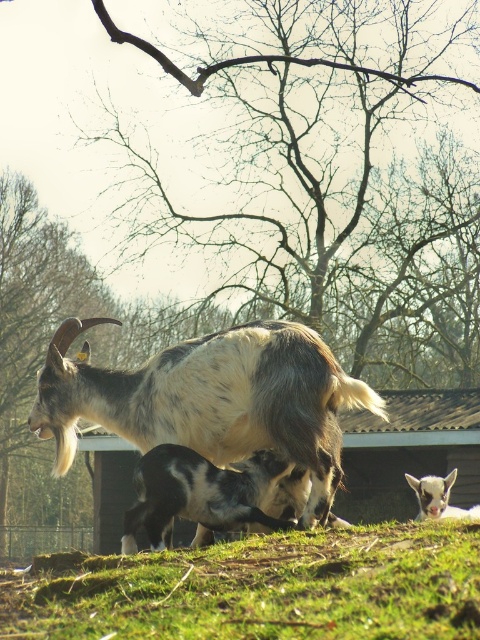
Question: Can you confirm if black and white fur at center is positioned below white woolen goat at lower right?

Choices:
 (A) yes
 (B) no

Answer: (A)

Question: Can you confirm if green grassy at lower center is wider than black and white fur at center?

Choices:
 (A) yes
 (B) no

Answer: (A)

Question: Which point appears farthest from the camera in this image?

Choices:
 (A) (166, 531)
 (B) (276, 538)
 (C) (140, 396)
 (D) (420, 508)

Answer: (C)

Question: Considering the real-world distances, which object is farthest from the white and brown fur goat at center?

Choices:
 (A) green grassy at lower center
 (B) white woolen goat at lower right
 (C) black and white fur at center

Answer: (A)

Question: Is green grassy at lower center positioned behind white and brown fur goat at center?

Choices:
 (A) yes
 (B) no

Answer: (B)

Question: Which object appears closest to the camera in this image?

Choices:
 (A) white woolen goat at lower right
 (B) black and white fur at center

Answer: (B)